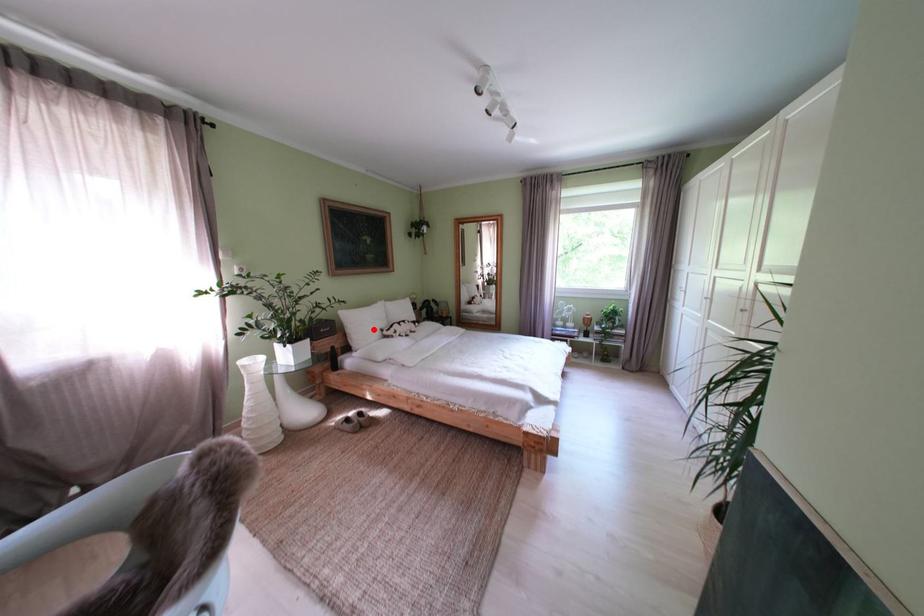
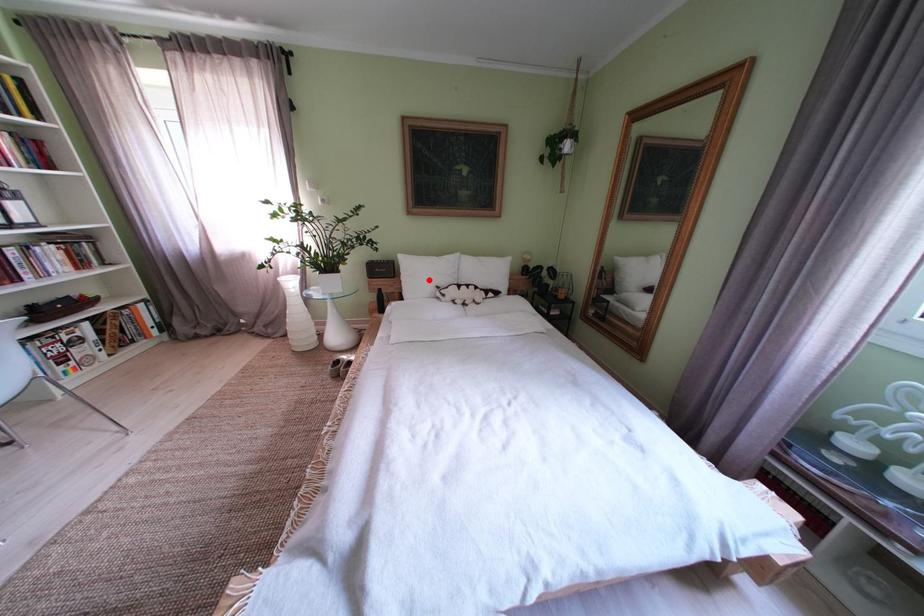
I am providing you with two images of the same scene from different viewpoints. A red point is marked on the first image and another point is marked on the second image. Does the point marked in image1 correspond to the same location as the one in image2?

Yes